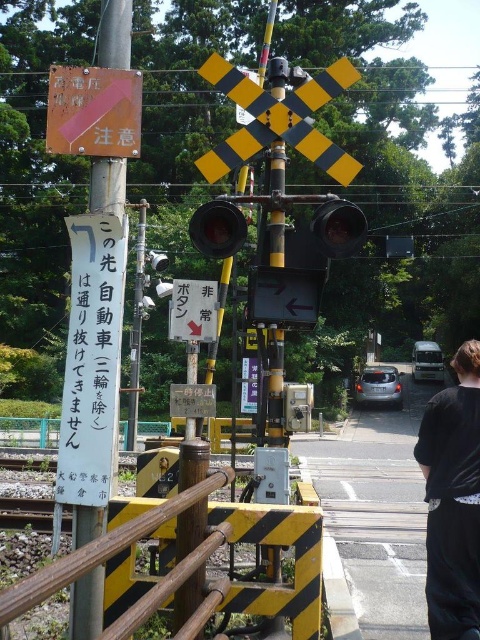
Question: Considering the relative positions of yellow/black striped rail at lower center and metallic gray button at center in the image provided, where is yellow/black striped rail at lower center located with respect to metallic gray button at center?

Choices:
 (A) left
 (B) right

Answer: (B)

Question: Which point is farther to the camera?

Choices:
 (A) metallic gray button at center
 (B) matte black traffic light at center
 (C) metallic bell at center

Answer: (A)

Question: Where is orange reflective sign at upper left located in relation to matte black traffic light at center in the image?

Choices:
 (A) left
 (B) right

Answer: (A)

Question: Which point is farther from the camera taking this photo?

Choices:
 (A) (444, 554)
 (B) (116, 140)
 (C) (204, 333)
 (D) (222, 221)

Answer: (C)

Question: Does yellow/black striped cross at upper center appear over metallic gray button at center?

Choices:
 (A) no
 (B) yes

Answer: (B)

Question: Estimate the real-world distances between objects in this image. Which object is farther from the black fabric bag at lower right?

Choices:
 (A) metallic bell at center
 (B) yellow/black striped cross at upper center
 (C) matte black traffic light at center

Answer: (B)